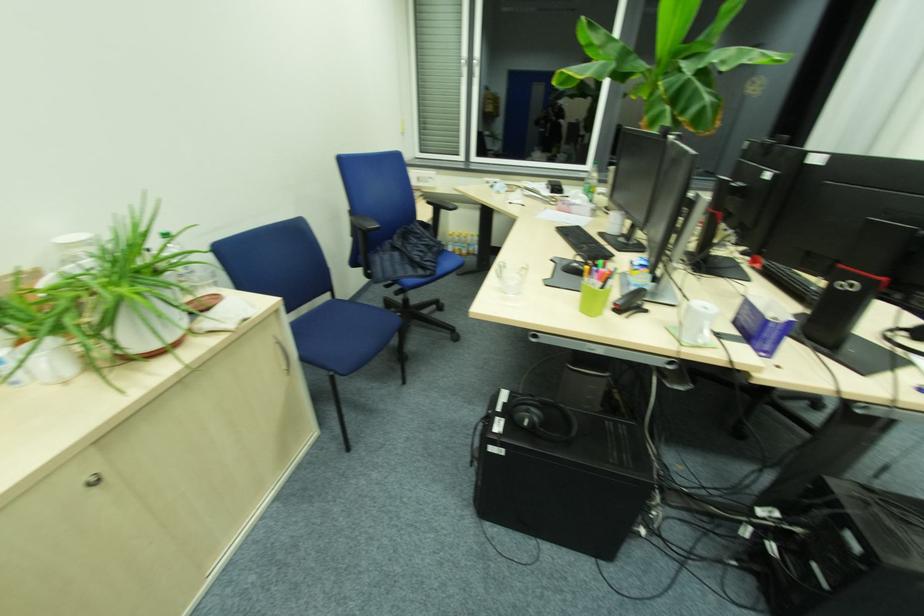
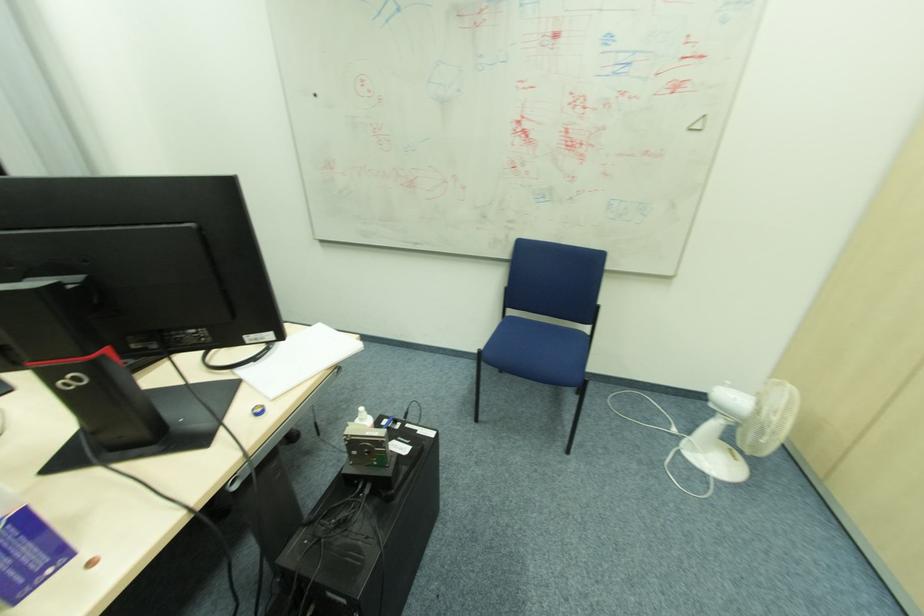
Based on the continuous images, in which direction is the camera rotating?

The camera's rotation is toward right-down.